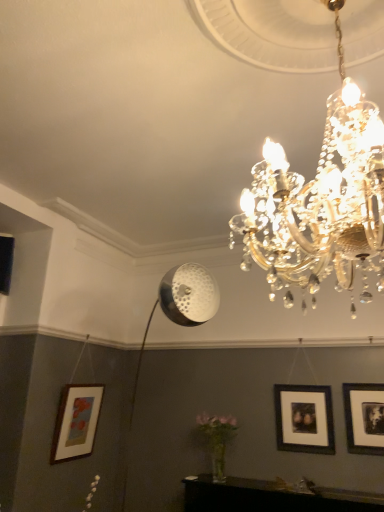
Where is `wooden matte picture frame at lower left, the 3th picture frame positioned from the right`? This screenshot has height=512, width=384. wooden matte picture frame at lower left, the 3th picture frame positioned from the right is located at coordinates (76, 422).

What do you see at coordinates (76, 422) in the screenshot? The height and width of the screenshot is (512, 384). I see `wooden matte picture frame at lower left, the 3th picture frame positioned from the right` at bounding box center [76, 422].

Describe the element at coordinates (304, 419) in the screenshot. I see `black matte picture frame at center right, acting as the second picture frame starting from the left` at that location.

The width and height of the screenshot is (384, 512). I want to click on wooden matte picture frame at lower left, the 3th picture frame positioned from the right, so click(x=76, y=422).

From the picture: Considering the sizes of objects black matte picture frame at right, which appears as the first picture frame when viewed from the right, and wooden matte picture frame at lower left, the first picture frame when ordered from left to right, in the image provided, who is shorter, black matte picture frame at right, which appears as the first picture frame when viewed from the right, or wooden matte picture frame at lower left, the first picture frame when ordered from left to right,?

With less height is black matte picture frame at right, which appears as the first picture frame when viewed from the right.

From a real-world perspective, is black matte picture frame at right, which appears as the first picture frame when viewed from the right, beneath wooden matte picture frame at lower left, the first picture frame when ordered from left to right?

No, from a real-world perspective, black matte picture frame at right, which appears as the first picture frame when viewed from the right, is not below wooden matte picture frame at lower left, the first picture frame when ordered from left to right.

Considering the relative positions of black matte picture frame at right, which appears as the first picture frame when viewed from the right, and wooden matte picture frame at lower left, the 3th picture frame positioned from the right, in the image provided, is black matte picture frame at right, which appears as the first picture frame when viewed from the right, to the left of wooden matte picture frame at lower left, the 3th picture frame positioned from the right, from the viewer's perspective?

Incorrect, black matte picture frame at right, which appears as the first picture frame when viewed from the right, is not on the left side of wooden matte picture frame at lower left, the 3th picture frame positioned from the right.

Can you confirm if wooden matte picture frame at lower left, the 3th picture frame positioned from the right, is positioned to the right of black matte picture frame at right, which appears as the first picture frame when viewed from the right?

No.

Is wooden matte picture frame at lower left, the 3th picture frame positioned from the right, not close to black matte picture frame at right, which appears as the first picture frame when viewed from the right?

Indeed, wooden matte picture frame at lower left, the 3th picture frame positioned from the right, is not near black matte picture frame at right, which appears as the first picture frame when viewed from the right.

From a real-world perspective, between wooden matte picture frame at lower left, the first picture frame when ordered from left to right, and black matte picture frame at right, positioned as the 3th picture frame in left-to-right order, who is vertically lower?

wooden matte picture frame at lower left, the first picture frame when ordered from left to right, is physically lower.

Find the location of a particular element. This screenshot has height=512, width=384. picture frame that appears below the black matte picture frame at center right, acting as the second picture frame starting from the left (from the image's perspective) is located at coordinates (76, 422).

Would you say wooden matte picture frame at lower left, the 3th picture frame positioned from the right, contains black matte picture frame at center right, acting as the second picture frame starting from the left?

That's incorrect, black matte picture frame at center right, acting as the second picture frame starting from the left, is not inside wooden matte picture frame at lower left, the 3th picture frame positioned from the right.

Is wooden matte picture frame at lower left, the 3th picture frame positioned from the right, looking in the opposite direction of black matte picture frame at center right, which appears as the second picture frame when viewed from the right?

No, wooden matte picture frame at lower left, the 3th picture frame positioned from the right, is not facing away from black matte picture frame at center right, which appears as the second picture frame when viewed from the right.

Which object is more forward, black matte picture frame at center right, which appears as the second picture frame when viewed from the right, or wooden matte picture frame at lower left, the first picture frame when ordered from left to right?

black matte picture frame at center right, which appears as the second picture frame when viewed from the right, is closer to the camera.

Is point (330, 402) farther from viewer compared to point (66, 442)?

No, (330, 402) is in front of (66, 442).

Considering the relative sizes of black matte picture frame at center right, which appears as the second picture frame when viewed from the right, and wooden matte picture frame at lower left, the first picture frame when ordered from left to right, in the image provided, is black matte picture frame at center right, which appears as the second picture frame when viewed from the right, thinner than wooden matte picture frame at lower left, the first picture frame when ordered from left to right,?

Indeed, black matte picture frame at center right, which appears as the second picture frame when viewed from the right, has a lesser width compared to wooden matte picture frame at lower left, the first picture frame when ordered from left to right.

Does black matte picture frame at center right, acting as the second picture frame starting from the left, touch wooden matte picture frame at lower left, the first picture frame when ordered from left to right?

No, black matte picture frame at center right, acting as the second picture frame starting from the left, is not touching wooden matte picture frame at lower left, the first picture frame when ordered from left to right.

From the picture: Is black matte picture frame at center right, acting as the second picture frame starting from the left, positioned with its back to black matte picture frame at right, positioned as the 3th picture frame in left-to-right order?

black matte picture frame at center right, acting as the second picture frame starting from the left, does not have its back to black matte picture frame at right, positioned as the 3th picture frame in left-to-right order.

Can you confirm if black matte picture frame at center right, which appears as the second picture frame when viewed from the right, is shorter than black matte picture frame at right, which appears as the first picture frame when viewed from the right?

No, black matte picture frame at center right, which appears as the second picture frame when viewed from the right, is not shorter than black matte picture frame at right, which appears as the first picture frame when viewed from the right.

Considering the relative sizes of black matte picture frame at center right, which appears as the second picture frame when viewed from the right, and black matte picture frame at right, which appears as the first picture frame when viewed from the right, in the image provided, is black matte picture frame at center right, which appears as the second picture frame when viewed from the right, wider than black matte picture frame at right, which appears as the first picture frame when viewed from the right,?

No, black matte picture frame at center right, which appears as the second picture frame when viewed from the right, is not wider than black matte picture frame at right, which appears as the first picture frame when viewed from the right.

Is black matte picture frame at right, positioned as the 3th picture frame in left-to-right order, situated inside black matte picture frame at center right, which appears as the second picture frame when viewed from the right, or outside?

black matte picture frame at right, positioned as the 3th picture frame in left-to-right order, cannot be found inside black matte picture frame at center right, which appears as the second picture frame when viewed from the right.

From a real-world perspective, is black matte picture frame at right, which appears as the first picture frame when viewed from the right, under black matte picture frame at center right, acting as the second picture frame starting from the left?

Actually, black matte picture frame at right, which appears as the first picture frame when viewed from the right, is physically above black matte picture frame at center right, acting as the second picture frame starting from the left, in the real world.

Can you confirm if black matte picture frame at right, positioned as the 3th picture frame in left-to-right order, is shorter than black matte picture frame at center right, which appears as the second picture frame when viewed from the right?

Yes.

Locate an element on the screen. The height and width of the screenshot is (512, 384). picture frame that is the 2nd object to the right of the wooden matte picture frame at lower left, the 3th picture frame positioned from the right, starting at the anchor is located at coordinates (364, 418).

The width and height of the screenshot is (384, 512). In order to click on picture frame that is the 2nd one below the black matte picture frame at right, which appears as the first picture frame when viewed from the right (from a real-world perspective) in this screenshot , I will do 76,422.

Looking at the image, which one is located closer to black matte picture frame at right, which appears as the first picture frame when viewed from the right, black matte picture frame at center right, acting as the second picture frame starting from the left, or wooden matte picture frame at lower left, the 3th picture frame positioned from the right?

black matte picture frame at center right, acting as the second picture frame starting from the left, is positioned closer to the anchor black matte picture frame at right, which appears as the first picture frame when viewed from the right.

When comparing their distances from black matte picture frame at center right, acting as the second picture frame starting from the left, does black matte picture frame at right, which appears as the first picture frame when viewed from the right, or wooden matte picture frame at lower left, the 3th picture frame positioned from the right, seem closer?

Among the two, black matte picture frame at right, which appears as the first picture frame when viewed from the right, is located nearer to black matte picture frame at center right, acting as the second picture frame starting from the left.

Looking at the image, which one is located closer to black matte picture frame at center right, which appears as the second picture frame when viewed from the right, wooden matte picture frame at lower left, the first picture frame when ordered from left to right, or black matte picture frame at right, positioned as the 3th picture frame in left-to-right order?

The object closer to black matte picture frame at center right, which appears as the second picture frame when viewed from the right, is black matte picture frame at right, positioned as the 3th picture frame in left-to-right order.

Based on their spatial positions, is black matte picture frame at right, which appears as the first picture frame when viewed from the right, or black matte picture frame at center right, which appears as the second picture frame when viewed from the right, closer to wooden matte picture frame at lower left, the first picture frame when ordered from left to right?

The object closer to wooden matte picture frame at lower left, the first picture frame when ordered from left to right, is black matte picture frame at center right, which appears as the second picture frame when viewed from the right.

Based on their spatial positions, is wooden matte picture frame at lower left, the first picture frame when ordered from left to right, or black matte picture frame at center right, which appears as the second picture frame when viewed from the right, further from black matte picture frame at right, positioned as the 3th picture frame in left-to-right order?

Based on the image, wooden matte picture frame at lower left, the first picture frame when ordered from left to right, appears to be further to black matte picture frame at right, positioned as the 3th picture frame in left-to-right order.

Based on their spatial positions, is black matte picture frame at center right, acting as the second picture frame starting from the left, or black matte picture frame at right, which appears as the first picture frame when viewed from the right, closer to wooden matte picture frame at lower left, the 3th picture frame positioned from the right?

The object closer to wooden matte picture frame at lower left, the 3th picture frame positioned from the right, is black matte picture frame at center right, acting as the second picture frame starting from the left.

Identify the location of picture frame located between wooden matte picture frame at lower left, the first picture frame when ordered from left to right, and black matte picture frame at right, positioned as the 3th picture frame in left-to-right order, in the left-right direction. This screenshot has height=512, width=384. (304, 419).